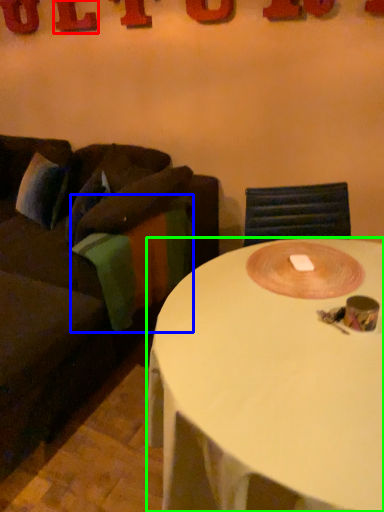
Question: Which object is the farthest from letter (highlighted by a red box)? Choose among these: blanket (highlighted by a blue box) or coffee table (highlighted by a green box).

Choices:
 (A) blanket
 (B) coffee table

Answer: (B)